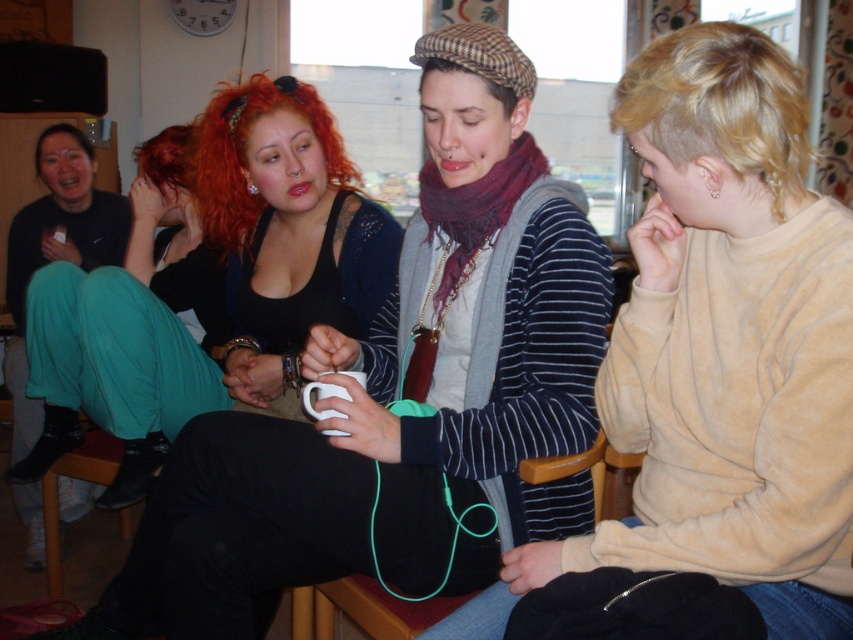
Question: Which point is closer to the camera?

Choices:
 (A) (490, 589)
 (B) (236, 577)

Answer: (B)

Question: Considering the relative positions of matte black tank top at center and striped sweater at center in the image provided, where is matte black tank top at center located with respect to striped sweater at center?

Choices:
 (A) right
 (B) left

Answer: (B)

Question: Can you confirm if matte black tank top at center is positioned below striped sweater at center?

Choices:
 (A) no
 (B) yes

Answer: (B)

Question: Which point is farther to the camera?

Choices:
 (A) (741, 445)
 (B) (463, 376)

Answer: (B)

Question: Which of the following is the closest to the observer?

Choices:
 (A) striped sweater at center
 (B) matte black tank top at center

Answer: (A)

Question: Is the position of matte black tank top at center less distant than that of striped sweater at center?

Choices:
 (A) no
 (B) yes

Answer: (A)